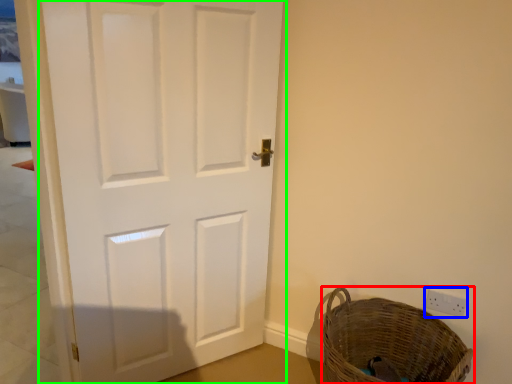
Question: Which is farther away from basket (highlighted by a red box)? electric outlet (highlighted by a blue box) or door (highlighted by a green box)?

Choices:
 (A) electric outlet
 (B) door

Answer: (B)